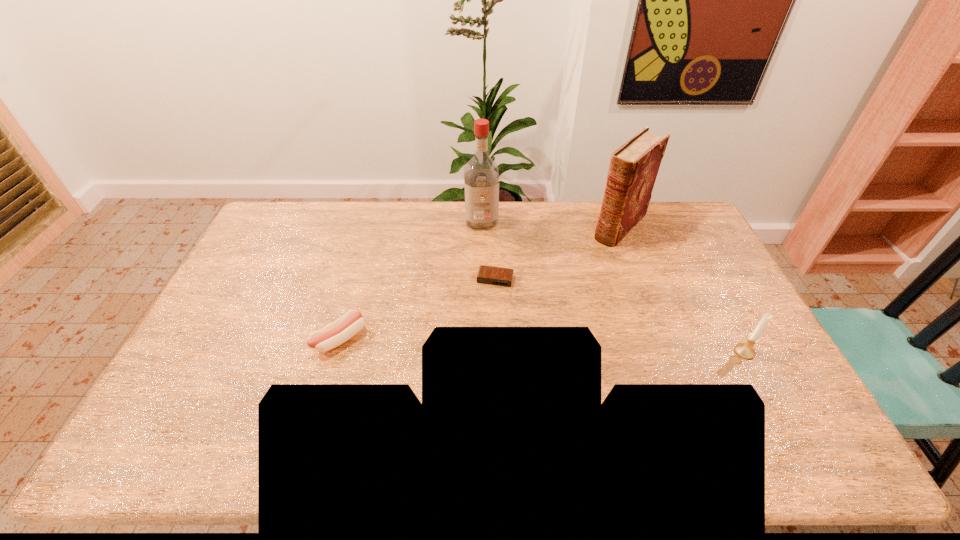
Identify which object is the second closest to the liquor. Please provide its 2D coordinates. Your answer should be formatted as a tuple, i.e. [(x, y)], where the tuple contains the x and y coordinates of a point satisfying the conditions above.

[(634, 166)]

The height and width of the screenshot is (540, 960). In order to click on object that is the second closest to the leftmost object in this screenshot , I will do `click(481, 176)`.

Find the location of a particular element. blank space that satisfies the following two spatial constraints: 1. on the front side of the third nearest object; 2. on the right side of the rightmost object is located at coordinates (497, 352).